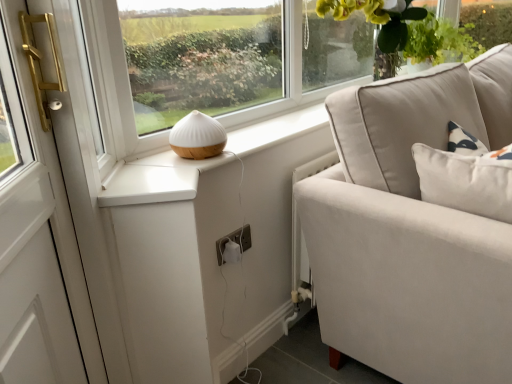
Question: Looking at their shapes, would you say white matte table lamp at center is wider or thinner than green leafy plant at upper right?

Choices:
 (A) thin
 (B) wide

Answer: (A)

Question: From the image's perspective, relative to green leafy plant at upper right, is white matte table lamp at center above or below?

Choices:
 (A) above
 (B) below

Answer: (B)

Question: Which of these objects is positioned closest to the white matte table lamp at center?

Choices:
 (A) white plastic electric outlet at lower center
 (B) green leafy plant at upper right

Answer: (A)

Question: Which object is positioned farthest from the white matte table lamp at center?

Choices:
 (A) white plastic electric outlet at lower center
 (B) green leafy plant at upper right

Answer: (B)